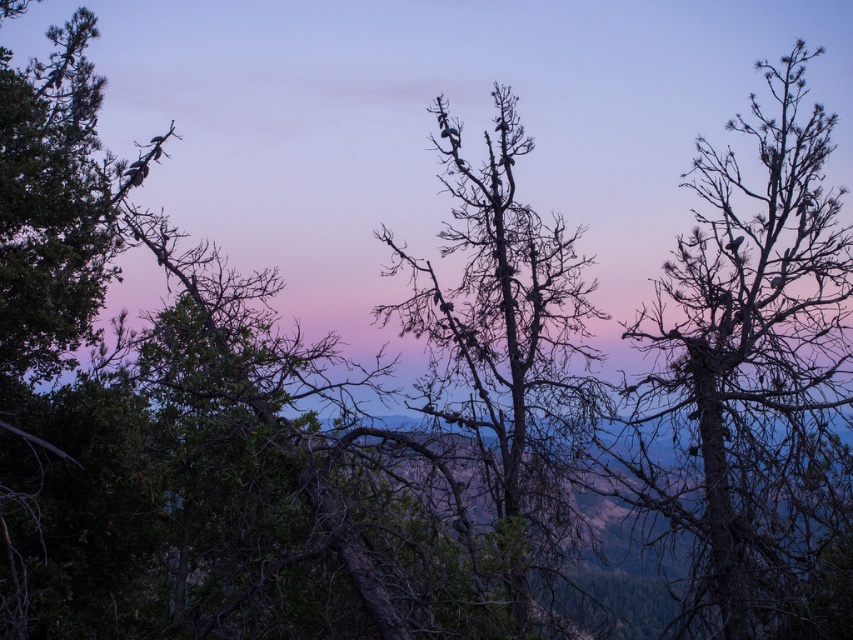
Is point (834, 563) positioned in front of point (547, 483)?

Yes.

Is point (831, 573) farther from camera compared to point (573, 426)?

No, (831, 573) is closer to viewer.

Between point (821, 538) and point (479, 208), which one is positioned behind?

Positioned behind is point (479, 208).

This screenshot has height=640, width=853. What are the coordinates of `dark brown bark tree at right` in the screenshot? It's located at (753, 385).